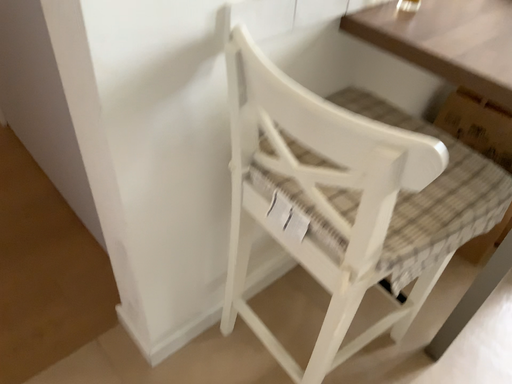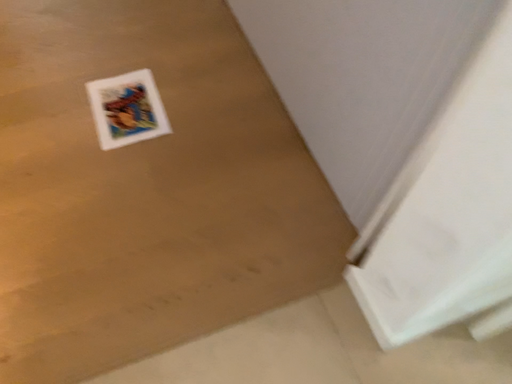
Question: How did the camera likely rotate when shooting the video?

Choices:
 (A) rotated left
 (B) rotated right

Answer: (A)